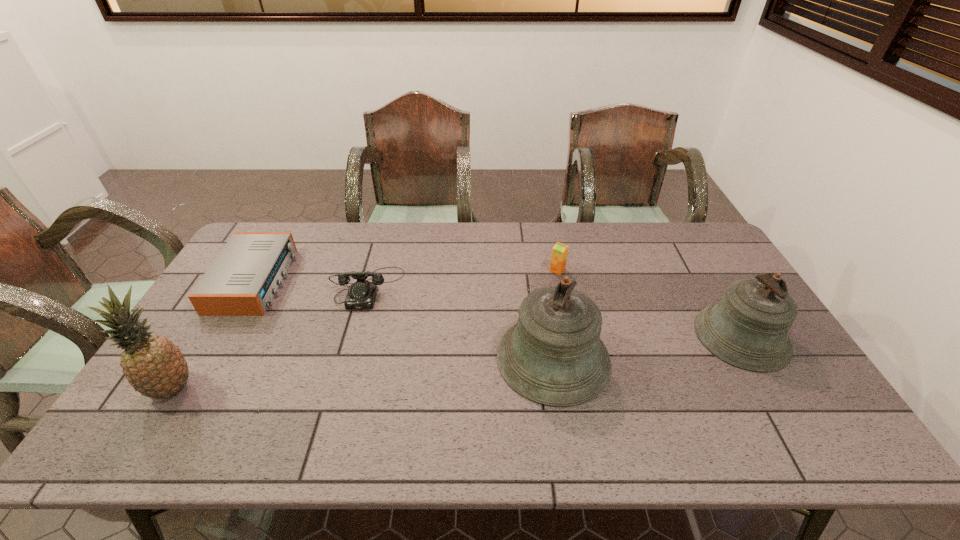
Identify the location of the left bell. (553, 355).

Find the location of a particular element. the shorter bell is located at coordinates (748, 328).

In order to click on the rightmost object in this screenshot , I will do `click(748, 328)`.

The image size is (960, 540). In order to click on the fourth tallest object in this screenshot , I will do `click(560, 251)`.

Locate an element on the screen. radio receiver is located at coordinates (242, 280).

Where is `pineapple`? pineapple is located at coordinates (154, 366).

Find the location of a particular element. the third object from left to right is located at coordinates (361, 295).

At what (x,y) coordinates should I click in order to perform the action: click on free space located on the right of the taller bell. Please return your answer as a coordinate pair (x, y). The height and width of the screenshot is (540, 960). Looking at the image, I should click on (665, 358).

In order to click on vacant space situated on the left of the right bell in this screenshot , I will do [679, 336].

The width and height of the screenshot is (960, 540). Identify the location of free region located on the back of the orange juice. (548, 226).